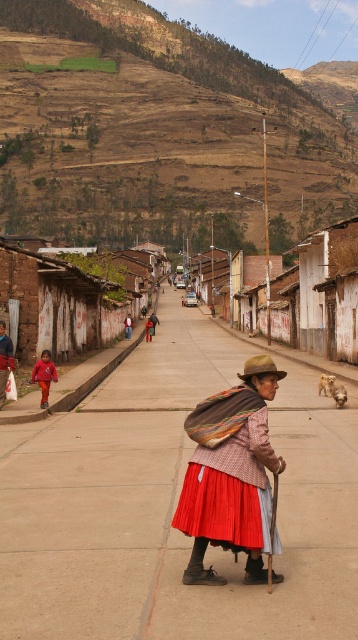
You are a photographer standing at the lower left corner of the street. You want to take a photo of the red fabric jacket at center while also including the red fabric skirt at lower left in the frame. Given that your camera has a maximum zoom range of 50 meters, can you capture both objects in a single shot?

The red fabric skirt at lower left and red fabric jacket at center are 35.86 meters apart. Since the distance between them is within the camera maximum zoom range of 50 meters, you can capture both objects in a single shot.

You are a traveler on the rural street and want to identify the woman wearing both a red fabric skirt at lower left and a red fabric jacket at center. Based on their positions, which item is closer to your viewpoint?

The red fabric skirt at lower left is below the red fabric jacket at center, meaning the jacket is higher in the image. Since the jacket is at center and the skirt is lower left, the jacket is closer to your viewpoint.